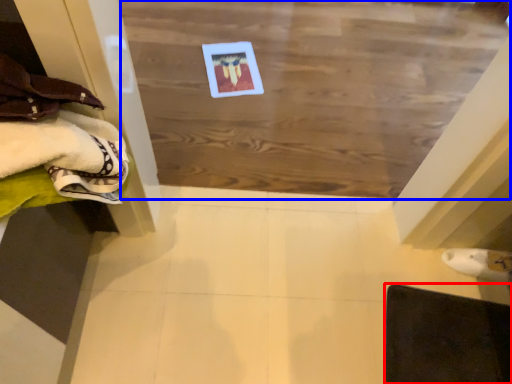
Question: Which of the following is the closest to the observer, furniture (highlighted by a red box) or plywood (highlighted by a blue box)?

Choices:
 (A) furniture
 (B) plywood

Answer: (A)